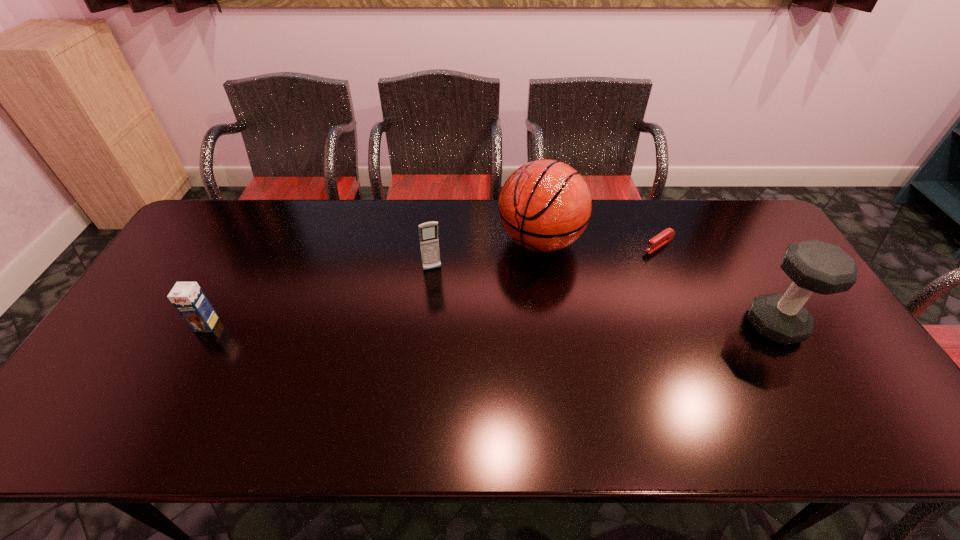
You are a GUI agent. You are given a task and a screenshot of the screen. Output one action in this format:
    pyautogui.click(x=<x>, y=<y>)
    Task: Click on the vacant space that's between the basketball and the third tallest object
    This screenshot has height=540, width=960.
    Given the screenshot: What is the action you would take?
    pyautogui.click(x=486, y=255)

In order to click on vacant space in between the cellular telephone and the leftmost object in this screenshot , I will do `click(320, 297)`.

This screenshot has width=960, height=540. I want to click on free space between the third object from right to left and the shortest object, so click(599, 243).

This screenshot has width=960, height=540. I want to click on unoccupied position between the third tallest object and the second shortest object, so click(x=320, y=297).

Where is `vacant region between the fourth object from left to right and the rightmost object`? The height and width of the screenshot is (540, 960). vacant region between the fourth object from left to right and the rightmost object is located at coordinates (717, 285).

You are a GUI agent. You are given a task and a screenshot of the screen. Output one action in this format:
    pyautogui.click(x=<x>, y=<y>)
    Task: Click on the free space between the fourth object from left to right and the rightmost object
    This screenshot has width=960, height=540.
    Given the screenshot: What is the action you would take?
    pyautogui.click(x=717, y=285)

At what (x,y) coordinates should I click in order to perform the action: click on vacant space that's between the rightmost object and the cellular telephone. Please return your answer as a coordinate pair (x, y). The image size is (960, 540). Looking at the image, I should click on (604, 297).

The image size is (960, 540). I want to click on the fourth closest object to the rightmost object, so click(x=188, y=298).

I want to click on the closest object to the cellular telephone, so click(x=545, y=205).

At what (x,y) coordinates should I click in order to perform the action: click on free region that satisfies the following two spatial constraints: 1. on the back side of the fourth object from right to left; 2. on the left side of the third object from right to left. Please return your answer as a coordinate pair (x, y). This screenshot has width=960, height=540. Looking at the image, I should click on (435, 241).